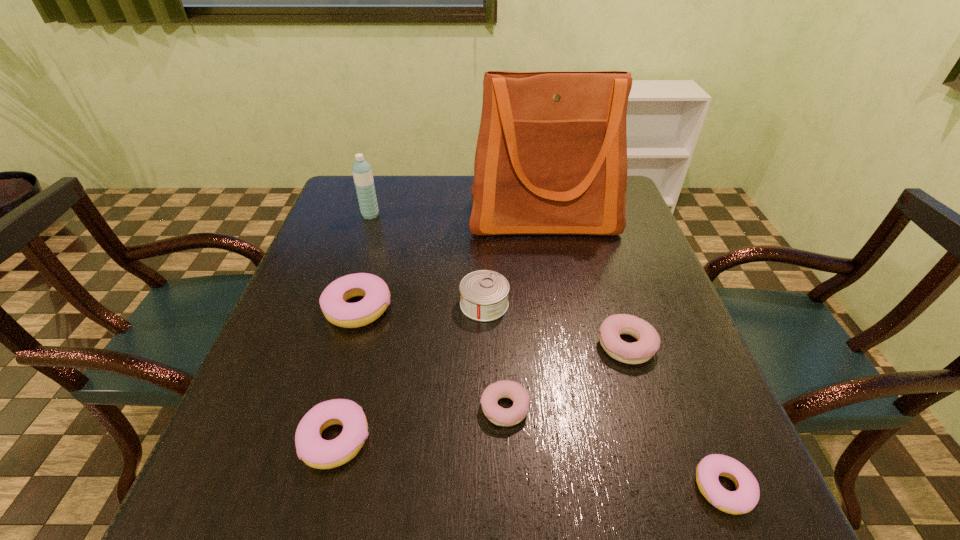
Where is `the nearer purple doughnut`? This screenshot has width=960, height=540. the nearer purple doughnut is located at coordinates (498, 415).

What are the coordinates of `the smallest pink doughnut` in the screenshot? It's located at (743, 500).

Where is `vacant space positioned on the front pocket of the shopping bag`? vacant space positioned on the front pocket of the shopping bag is located at coordinates (558, 298).

Locate an element on the screen. vacant area situated on the right of the second tallest object is located at coordinates (495, 215).

Where is `free space located 0.370m on the back of the silver can`? free space located 0.370m on the back of the silver can is located at coordinates (483, 202).

This screenshot has width=960, height=540. In order to click on free spot located on the right of the biggest pink doughnut in this screenshot , I will do `click(433, 308)`.

Locate an element on the screen. vacant space located 0.100m on the back of the farther purple doughnut is located at coordinates (610, 292).

Image resolution: width=960 pixels, height=540 pixels. In order to click on free space located 0.300m on the right of the second biggest pink doughnut in this screenshot , I will do `click(547, 440)`.

Find the location of `blank area located 0.150m on the left of the nearer purple doughnut`. blank area located 0.150m on the left of the nearer purple doughnut is located at coordinates (396, 408).

Locate an element on the screen. This screenshot has height=540, width=960. vacant area situated 0.140m on the back of the smallest pink doughnut is located at coordinates (683, 387).